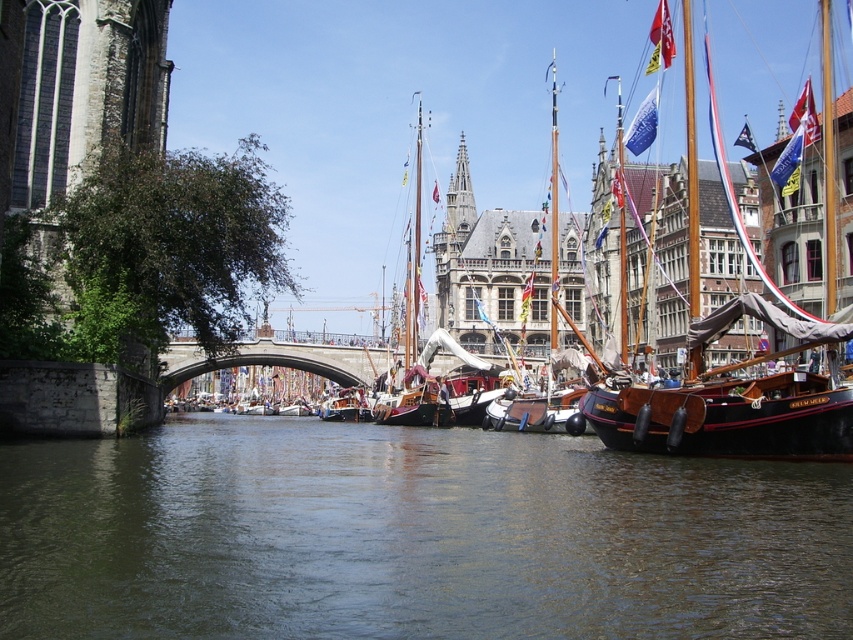
You are a tourist standing on the stone bridge on the left side of the canal. You want to take a photo of both the wooden sailboat at right and the wooden sailboat at center. Which boat should you zoom in on first to ensure both are in the frame?

The wooden sailboat at right is larger in size than the wooden sailboat at center. Therefore, you should zoom in on the wooden sailboat at center first to ensure both are in the frame, as it is smaller and might require closer framing to capture alongside the larger boat.

You are a tourist standing on the stone bridge on the left side of the canal. You want to take a photo of the wooden sailboat at center and the dark green water at center. Which one will occupy more of the photo frame?

The wooden sailboat at center occupies more space than the dark green water at center, so the wooden sailboat at center will take up more of the photo frame.